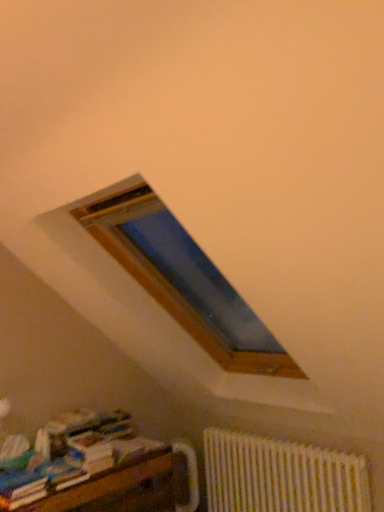
Question: Is multicolored paper at lower left inside the boundaries of white textured radiator at lower right, or outside?

Choices:
 (A) outside
 (B) inside

Answer: (A)

Question: Looking at their shapes, would you say multicolored paper at lower left is wider or thinner than white textured radiator at lower right?

Choices:
 (A) wide
 (B) thin

Answer: (A)

Question: Which object is positioned closest to the white textured radiator at lower right?

Choices:
 (A) wooden bookshelf at lower left
 (B) multicolored paper at lower left

Answer: (A)

Question: Estimate the real-world distances between objects in this image. Which object is farther from the multicolored paper at lower left?

Choices:
 (A) white textured radiator at lower right
 (B) wooden bookshelf at lower left

Answer: (A)